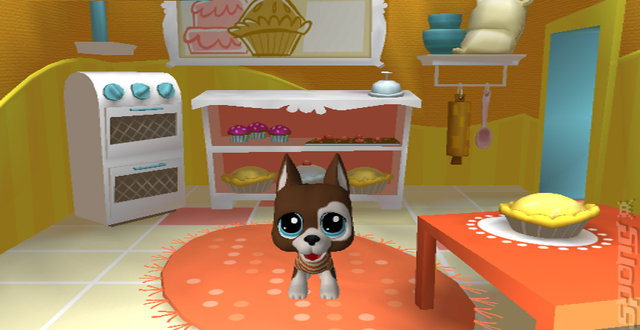
Find the location of a particular element. The width and height of the screenshot is (640, 330). pie on table is located at coordinates (537, 206).